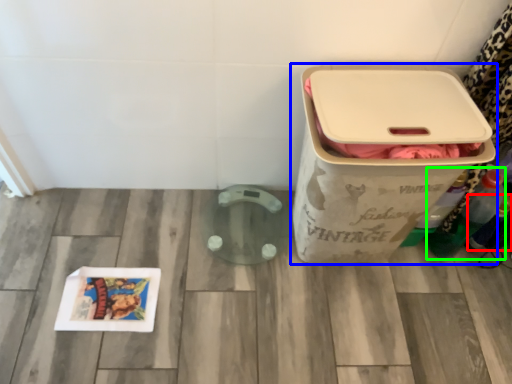
Question: Based on their relative distances, which object is nearer to bottle (highlighted by a red box)? Choose from waste container (highlighted by a blue box) and bottle (highlighted by a green box).

Choices:
 (A) waste container
 (B) bottle

Answer: (B)